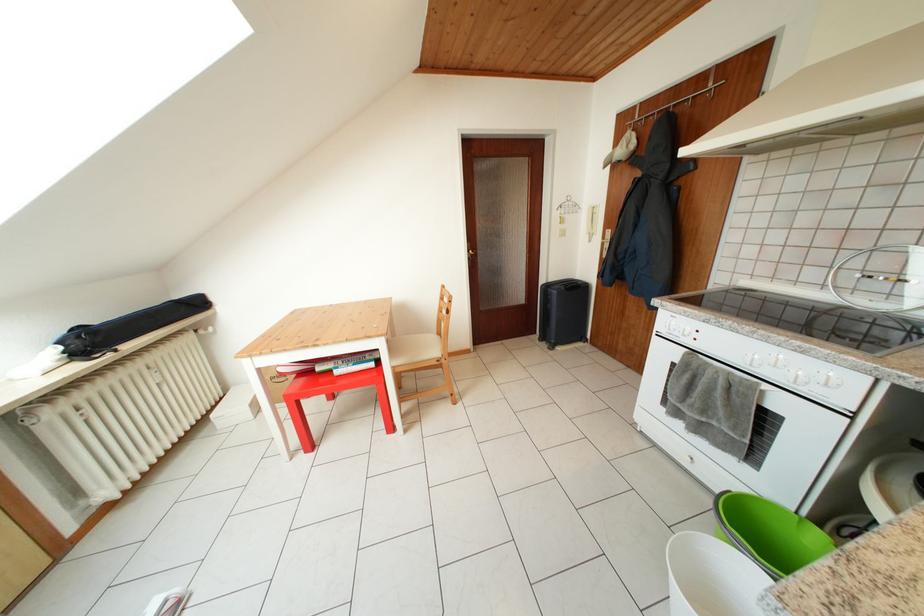
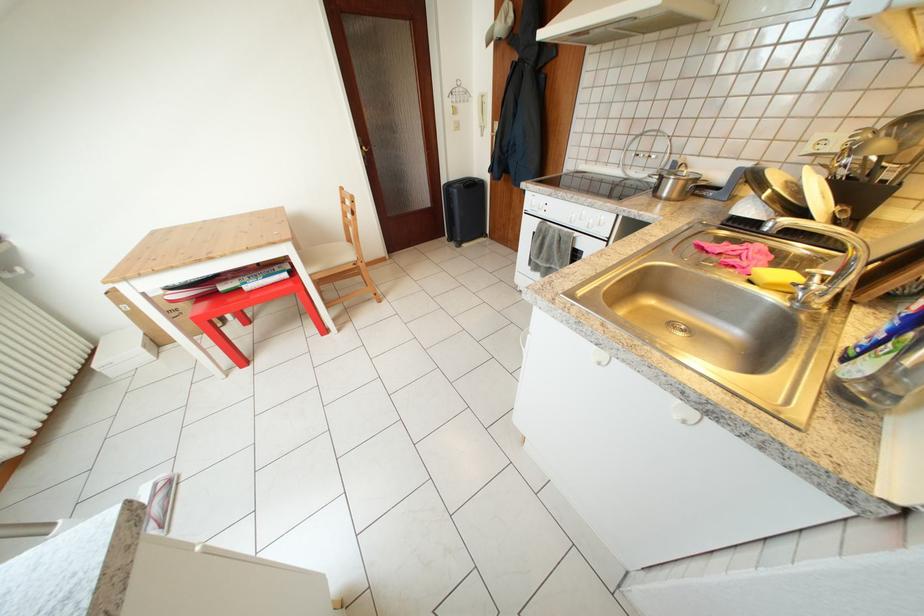
Question: What movement of the cameraman would produce the second image?

Choices:
 (A) Left
 (B) Right
 (C) Forward
 (D) Backward

Answer: (D)